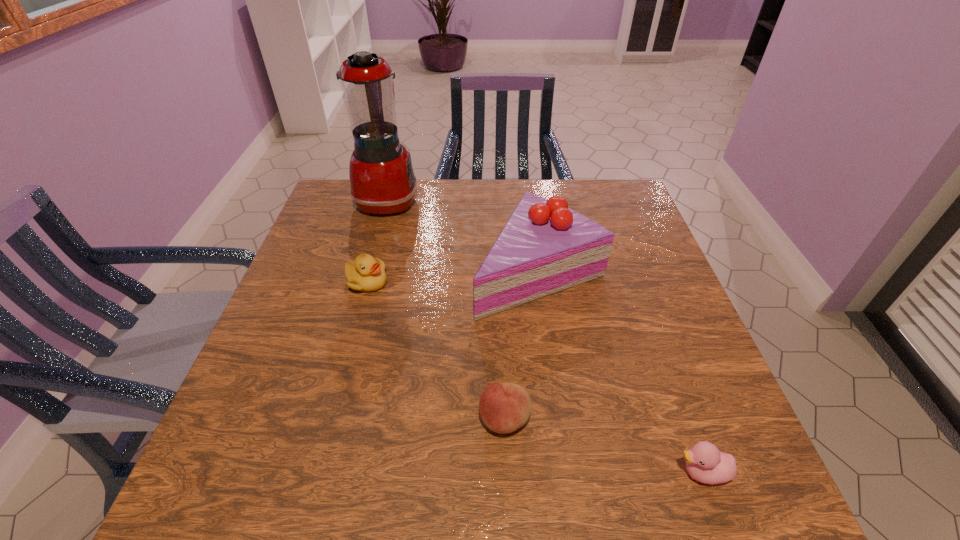
Find the location of `object that is at the far left corner`. object that is at the far left corner is located at coordinates (382, 179).

What are the coordinates of `object situated at the near right corner` in the screenshot? It's located at (705, 463).

You are a GUI agent. You are given a task and a screenshot of the screen. Output one action in this format:
    pyautogui.click(x=<x>, y=<y>)
    Task: Click on the vacant position at the far edge of the desktop
    The width and height of the screenshot is (960, 540).
    Given the screenshot: What is the action you would take?
    pyautogui.click(x=515, y=194)

You are a GUI agent. You are given a task and a screenshot of the screen. Output one action in this format:
    pyautogui.click(x=<x>, y=<y>)
    Task: Click on the vacant space at the near edge of the desktop
    The width and height of the screenshot is (960, 540).
    Given the screenshot: What is the action you would take?
    pyautogui.click(x=331, y=476)

Locate an element on the screen. Image resolution: width=960 pixels, height=540 pixels. free region at the left edge of the desktop is located at coordinates (307, 352).

Identify the location of vacant region at the right edge of the desktop. This screenshot has width=960, height=540. (667, 312).

This screenshot has width=960, height=540. I want to click on free spot at the far left corner of the desktop, so click(x=325, y=213).

You are a GUI agent. You are given a task and a screenshot of the screen. Output one action in this format:
    pyautogui.click(x=<x>, y=<y>)
    Task: Click on the free spot at the near left corner of the desktop
    The width and height of the screenshot is (960, 540).
    Given the screenshot: What is the action you would take?
    pyautogui.click(x=243, y=491)

The image size is (960, 540). I want to click on free point at the near right corner, so click(686, 471).

At what (x,y) coordinates should I click in order to perform the action: click on empty location between the tallest object and the farther duckling. Please return your answer as a coordinate pair (x, y). This screenshot has height=540, width=960. Looking at the image, I should click on (377, 241).